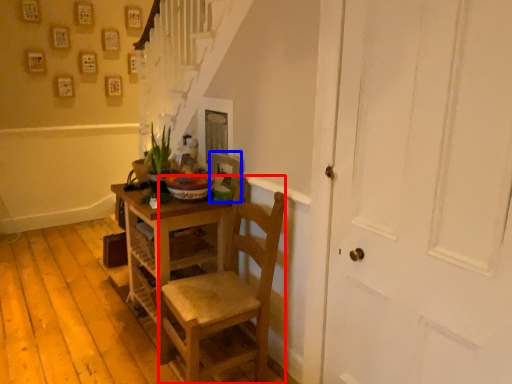
Question: Which of the following is the closest to the observer, chair (highlighted by a red box) or picture frame (highlighted by a blue box)?

Choices:
 (A) chair
 (B) picture frame

Answer: (A)